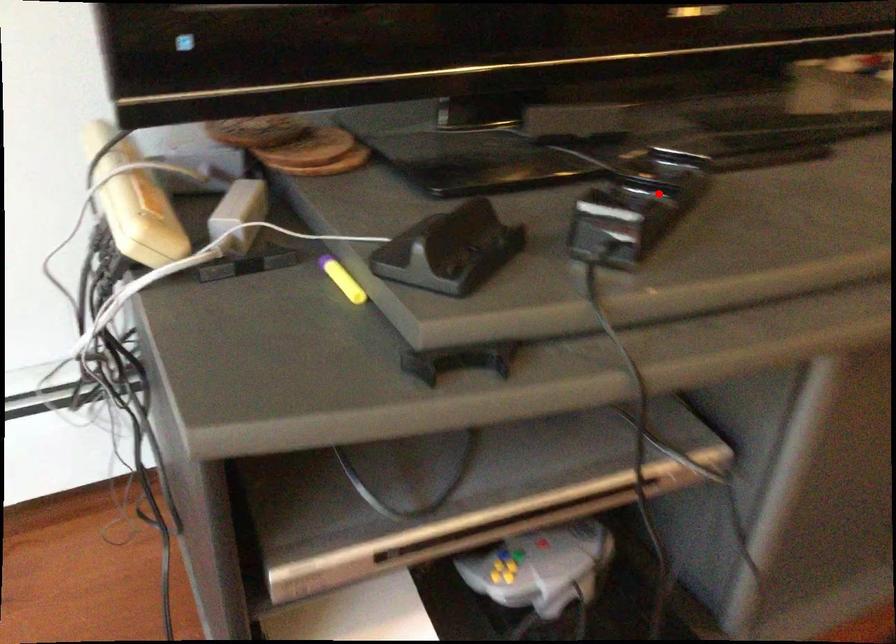
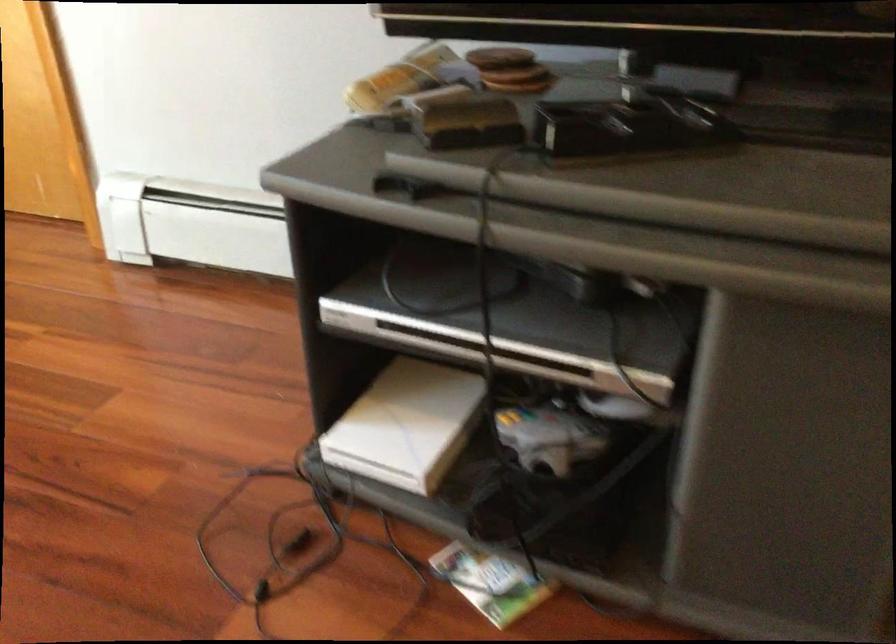
Where in the second image is the point corresponding to the highlighted location from the first image?

(627, 126)